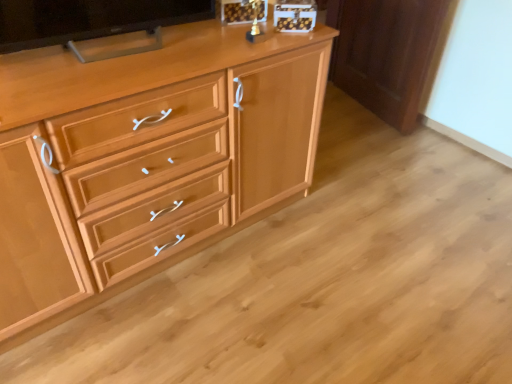
Locate an element on the screen. free space in front of light brown wood cabinet at right is located at coordinates (387, 146).